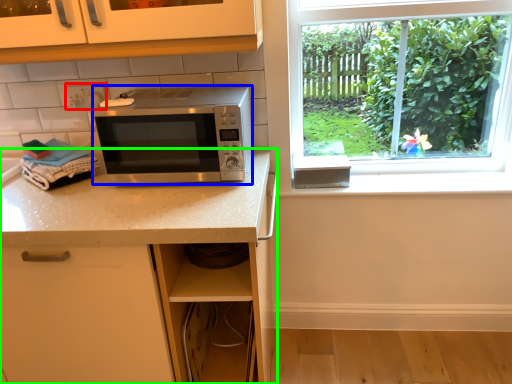
Question: Considering the real-world distances, which object is farthest from electric outlet (highlighted by a red box)? microwave oven (highlighted by a blue box) or countertop (highlighted by a green box)?

Choices:
 (A) microwave oven
 (B) countertop

Answer: (B)